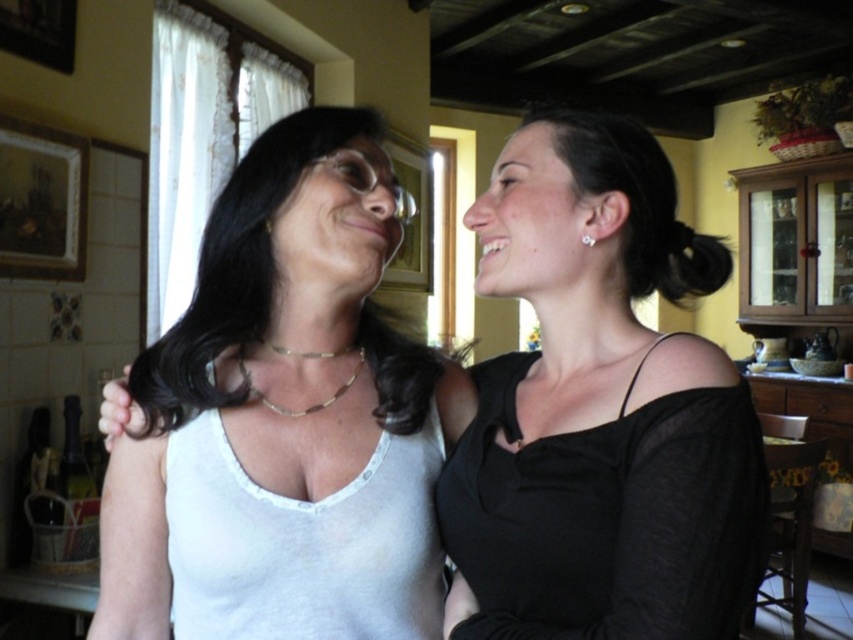
Identify the location of white matte tank top at center. Image resolution: width=853 pixels, height=640 pixels. (281, 344).

Is point (109, 483) behind point (270, 228)?

Yes.

The image size is (853, 640). In order to click on white matte tank top at center in this screenshot , I will do `click(281, 344)`.

Which is more to the right, black sheer dress at right or white fabric tank top at center?

From the viewer's perspective, black sheer dress at right appears more on the right side.

Is point (727, 616) farther from camera compared to point (293, 540)?

No, it is in front of (293, 540).

Where is `black sheer dress at right`? This screenshot has height=640, width=853. black sheer dress at right is located at coordinates (606, 516).

Is point (346, 348) more distant than point (267, 232)?

Yes, point (346, 348) is farther from viewer.

I want to click on gold chain necklace at center, so click(306, 406).

Identify the location of gold chain necklace at center. This screenshot has height=640, width=853. (306, 406).